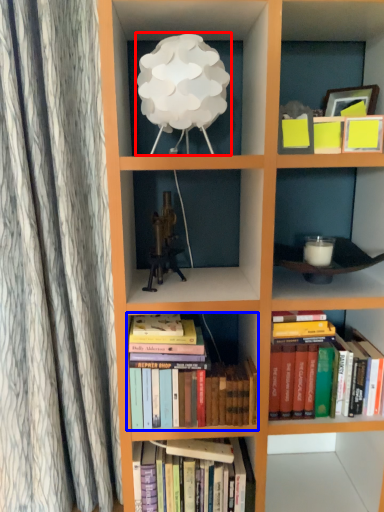
Question: Which point is closer to the camera, table lamp (highlighted by a red box) or book (highlighted by a blue box)?

Choices:
 (A) table lamp
 (B) book

Answer: (A)